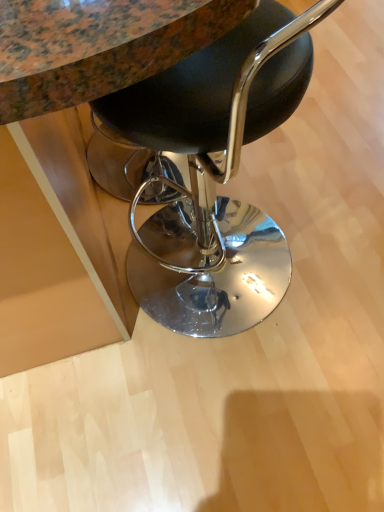
The height and width of the screenshot is (512, 384). Describe the element at coordinates (213, 172) in the screenshot. I see `black leather stool at center` at that location.

Identify the location of black leather stool at center. (213, 172).

Locate an element on the screen. The height and width of the screenshot is (512, 384). black leather stool at center is located at coordinates (213, 172).